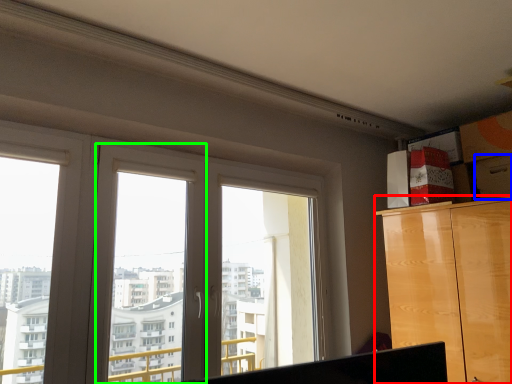
Question: Considering the real-world distances, which object is farthest from cabinetry (highlighted by a red box)? drawer (highlighted by a blue box) or window frame (highlighted by a green box)?

Choices:
 (A) drawer
 (B) window frame

Answer: (B)